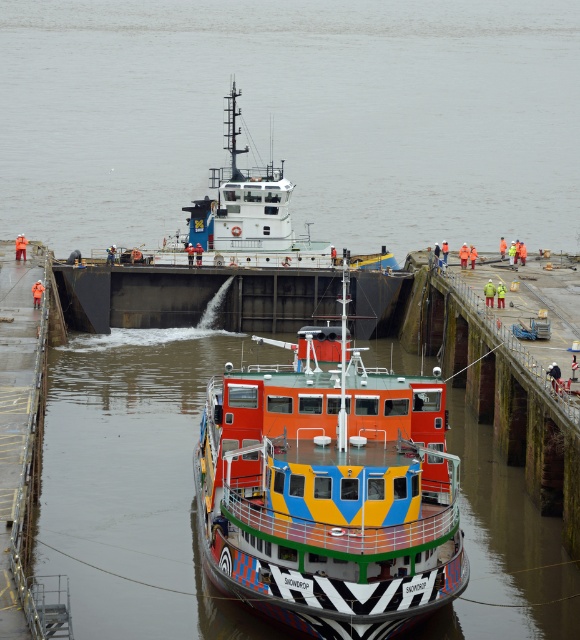
You are an observer standing on the dock. You see the multicolored painted ship at center and the white glossy tugboat at center. Which one is closer to you?

The multicolored painted ship at center is closer to you because it is in front of the white glossy tugboat at center.